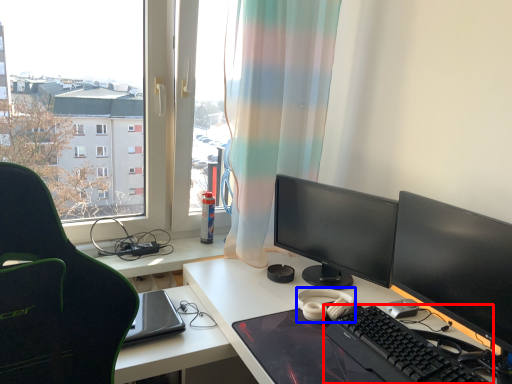
Question: Which object is further to the camera taking this photo, computer keyboard (highlighted by a red box) or headphones (highlighted by a blue box)?

Choices:
 (A) computer keyboard
 (B) headphones

Answer: (B)